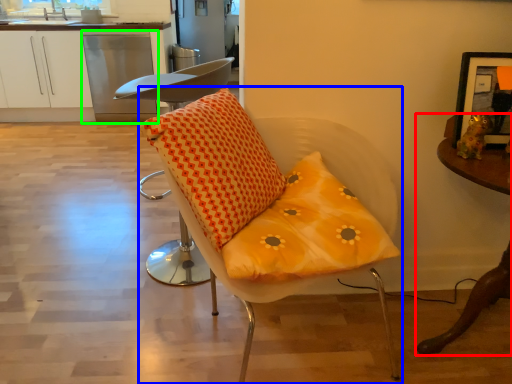
Question: Which object is the farthest from table (highlighted by a red box)? Choose among these: chair (highlighted by a blue box) or dish washer (highlighted by a green box).

Choices:
 (A) chair
 (B) dish washer

Answer: (B)